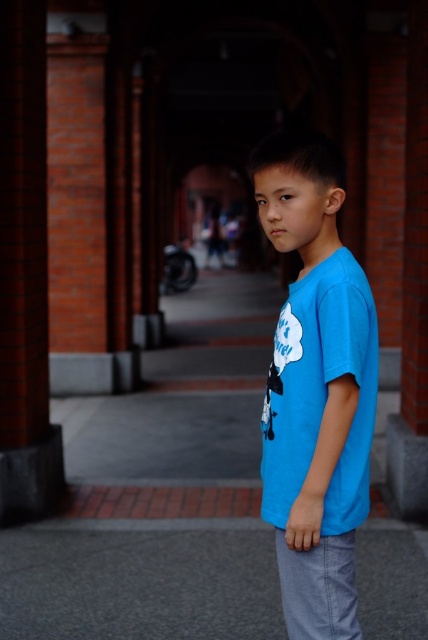
Question: Which point appears farthest from the camera in this image?

Choices:
 (A) (371, 556)
 (B) (366, 364)

Answer: (A)

Question: Does blue cotton shirt at center have a smaller size compared to gray asphalt pavement at lower center?

Choices:
 (A) yes
 (B) no

Answer: (B)

Question: Does blue cotton shirt at center have a lesser width compared to gray asphalt pavement at lower center?

Choices:
 (A) yes
 (B) no

Answer: (A)

Question: Is blue cotton shirt at center in front of gray asphalt pavement at lower center?

Choices:
 (A) no
 (B) yes

Answer: (B)